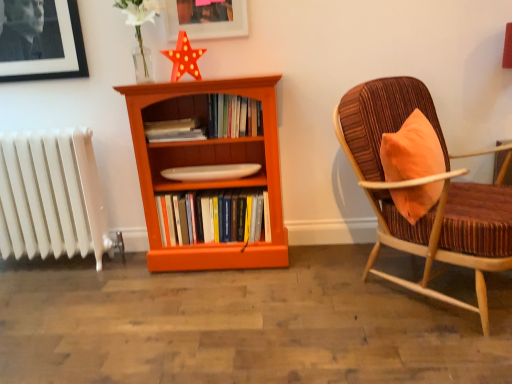
At what (x,y) coordinates should I click in order to perform the action: click on free region under white painted radiator at left (from a real-world perspective). Please return your answer as a coordinate pair (x, y). Looking at the image, I should click on (60, 269).